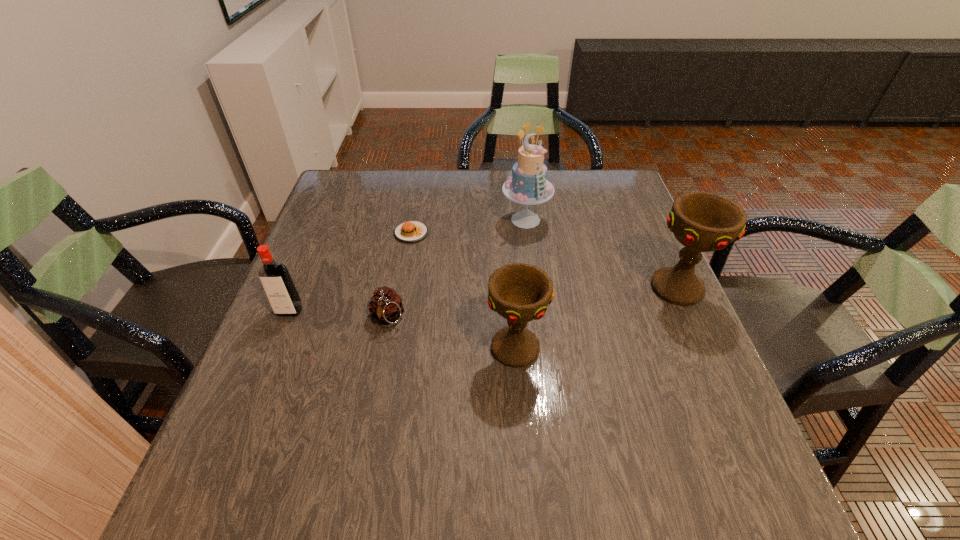
The image size is (960, 540). In order to click on vacant space that's between the rightmost object and the left chalice in this screenshot , I will do `click(596, 318)`.

This screenshot has height=540, width=960. In order to click on free space between the leftmost object and the second shortest object in this screenshot , I will do `click(338, 314)`.

Locate an element on the screen. Image resolution: width=960 pixels, height=540 pixels. vacant area between the food and the cake is located at coordinates (468, 226).

Where is `free space between the second shortest object and the vodka`? This screenshot has width=960, height=540. free space between the second shortest object and the vodka is located at coordinates (338, 314).

Locate an element on the screen. The width and height of the screenshot is (960, 540). blank region between the food and the fifth tallest object is located at coordinates (399, 275).

Select which object is the closest to the vodka. Please provide its 2D coordinates. Your answer should be formatted as a tuple, i.e. [(x, y)], where the tuple contains the x and y coordinates of a point satisfying the conditions above.

[(385, 306)]

Identify which object is the fifth nearest to the food. Please provide its 2D coordinates. Your answer should be formatted as a tuple, i.e. [(x, y)], where the tuple contains the x and y coordinates of a point satisfying the conditions above.

[(702, 222)]

Where is `vacant space that satisfies the following two spatial constraints: 1. on the front and back of the shorter chalice; 2. on the left side of the leftmost object`? This screenshot has height=540, width=960. vacant space that satisfies the following two spatial constraints: 1. on the front and back of the shorter chalice; 2. on the left side of the leftmost object is located at coordinates (275, 348).

The image size is (960, 540). Identify the location of vacant area in the image that satisfies the following two spatial constraints: 1. with a leaf charm attached to the left chalice; 2. on the left side of the fifth tallest object. (381, 348).

The image size is (960, 540). Find the location of `free space that satisfies the following two spatial constraints: 1. on the back side of the left chalice; 2. on the right side of the farther chalice`. free space that satisfies the following two spatial constraints: 1. on the back side of the left chalice; 2. on the right side of the farther chalice is located at coordinates (512, 288).